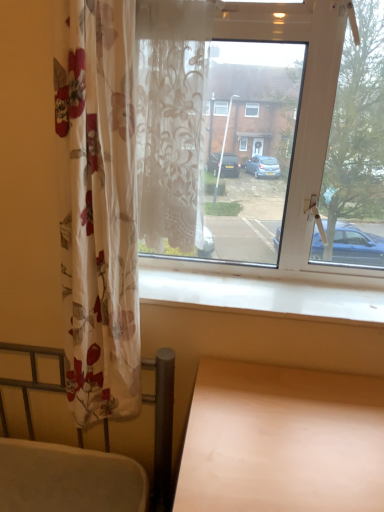
Identify the location of vacant area situated below translucent floral curtain at center (from a real-world perspective). (165, 278).